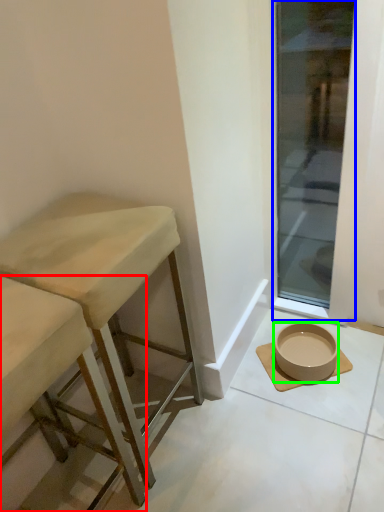
Question: Based on their relative distances, which object is nearer to stool (highlighted by a red box)? Choose from window (highlighted by a blue box) and bowl (highlighted by a green box).

Choices:
 (A) window
 (B) bowl

Answer: (B)